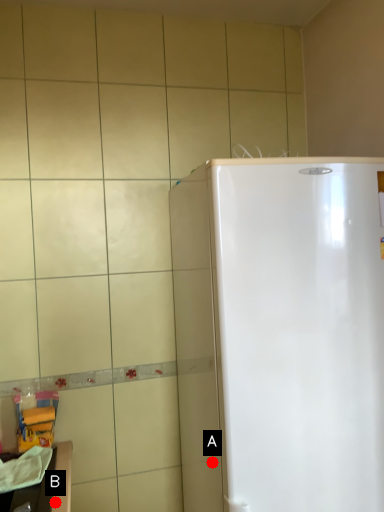
Question: Two points are circled on the image, labeled by A and B beside each circle. Which point is closer to the camera?

Choices:
 (A) A is closer
 (B) B is closer

Answer: (A)